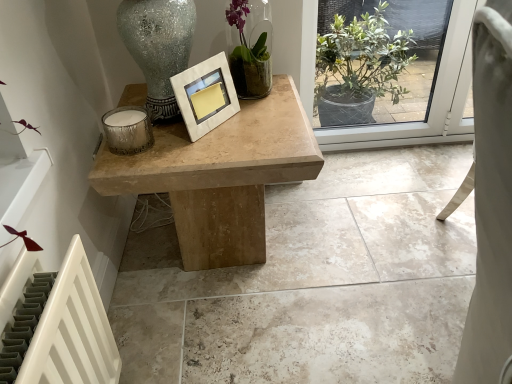
Where is `vacant space to the right of white marble picture frame at center`? The height and width of the screenshot is (384, 512). vacant space to the right of white marble picture frame at center is located at coordinates (256, 129).